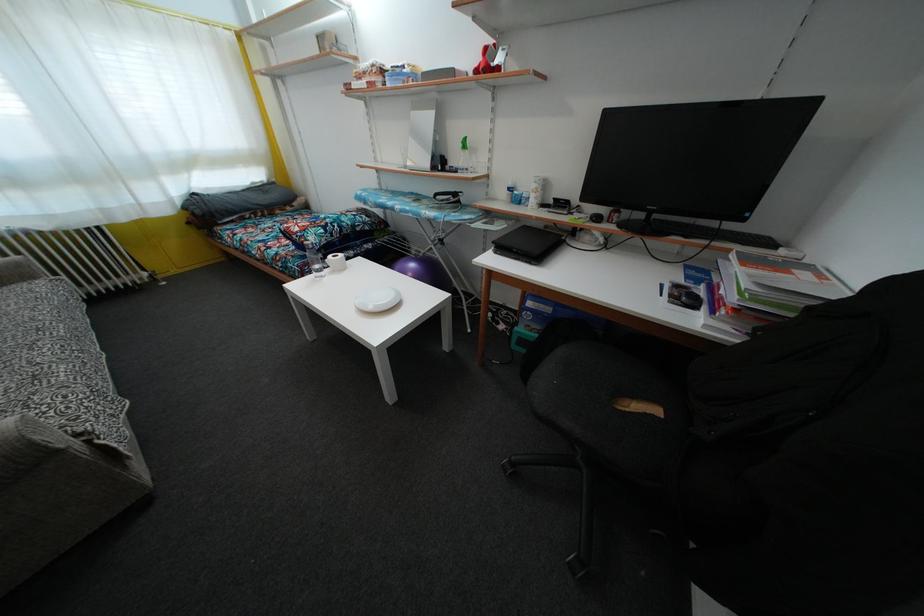
What do you see at coordinates (45, 342) in the screenshot? I see `a grey sofa sitting surface` at bounding box center [45, 342].